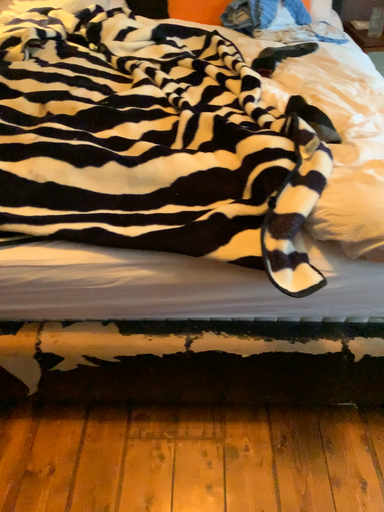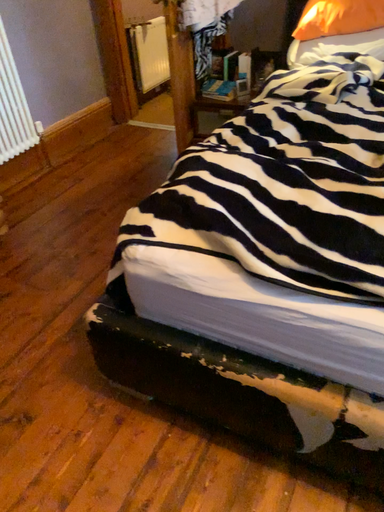
Question: How did the camera likely rotate when shooting the video?

Choices:
 (A) rotated upward
 (B) rotated downward

Answer: (A)